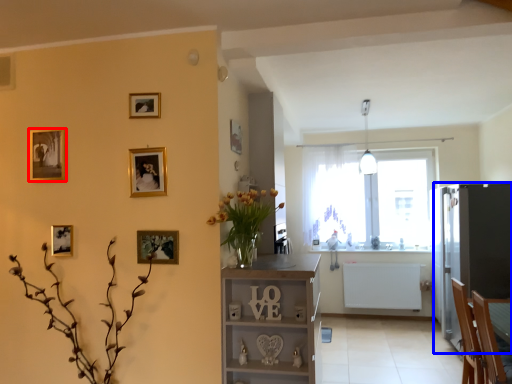
Question: Which point is closer to the camera, picture frame (highlighted by a red box) or fridge (highlighted by a blue box)?

Choices:
 (A) picture frame
 (B) fridge

Answer: (A)